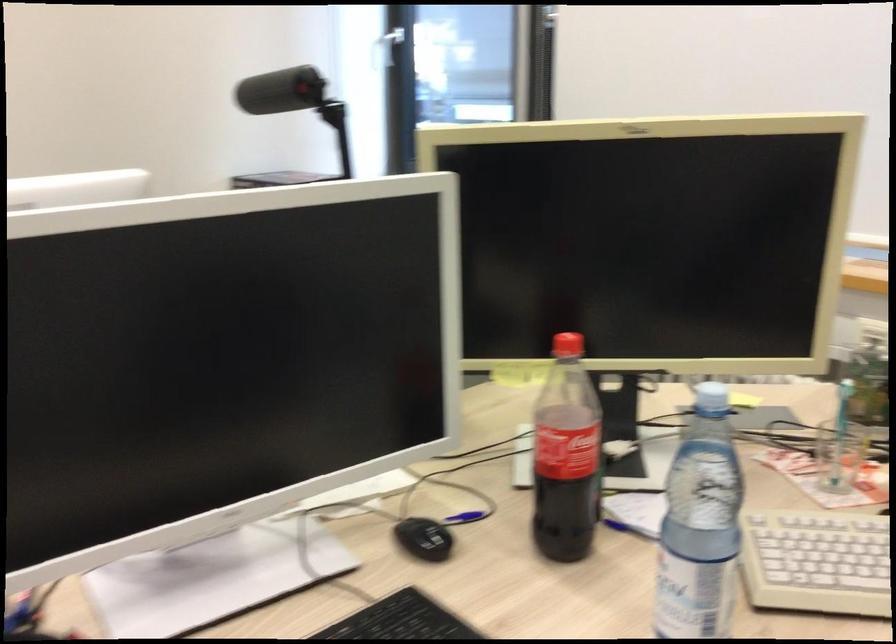
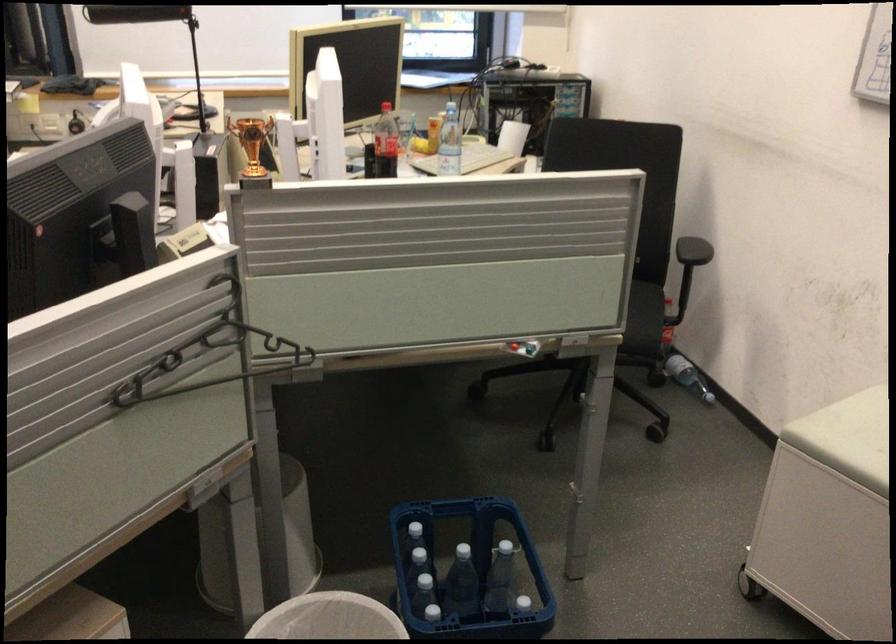
Question: I am providing you with two images of the same scene from different viewpoints. After the viewpoint changes to image2, which objects are now occluded?

Choices:
 (A) black computer mouse
 (B) soap pump
 (C) white trash can
 (D) black clothes hanger

Answer: (A)